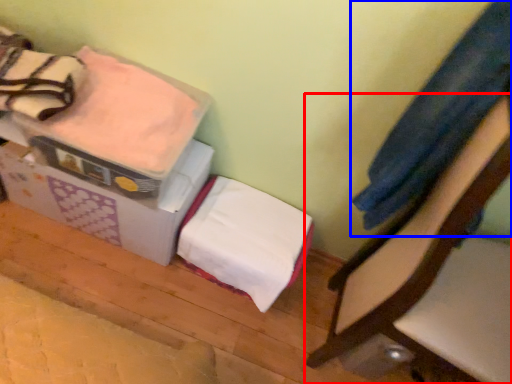
Question: Which object appears farthest to the camera in this image, furniture (highlighted by a red box) or clothing (highlighted by a blue box)?

Choices:
 (A) furniture
 (B) clothing

Answer: (B)